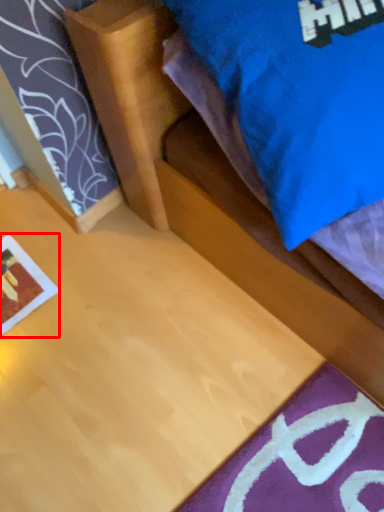
Question: From the image's perspective, considering the relative positions of print (annotated by the red box) and bed in the image provided, where is print (annotated by the red box) located with respect to the staircase?

Choices:
 (A) below
 (B) above

Answer: (A)